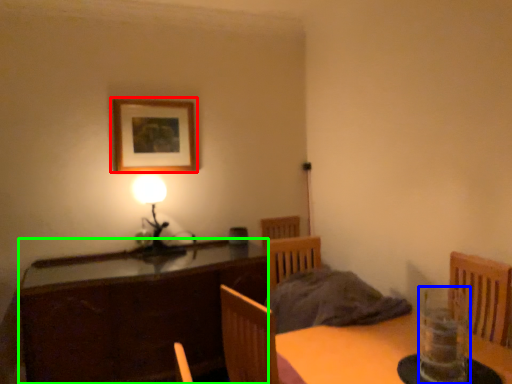
Question: Estimate the real-world distances between objects in this image. Which object is farther from picture frame (highlighted by a red box), glass vase (highlighted by a blue box) or cabinetry (highlighted by a green box)?

Choices:
 (A) glass vase
 (B) cabinetry

Answer: (A)